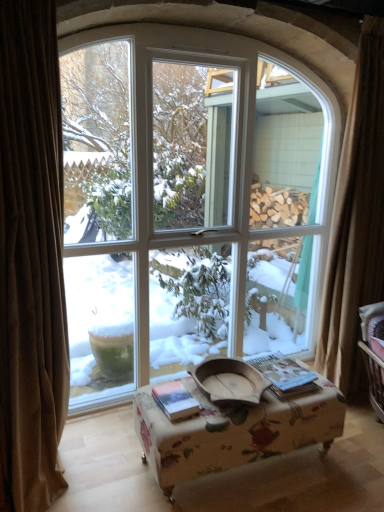
The image size is (384, 512). I want to click on vacant space situated above hardcover book at center, marked as the 1th book in a left-to-right arrangement (from a real-world perspective), so click(177, 399).